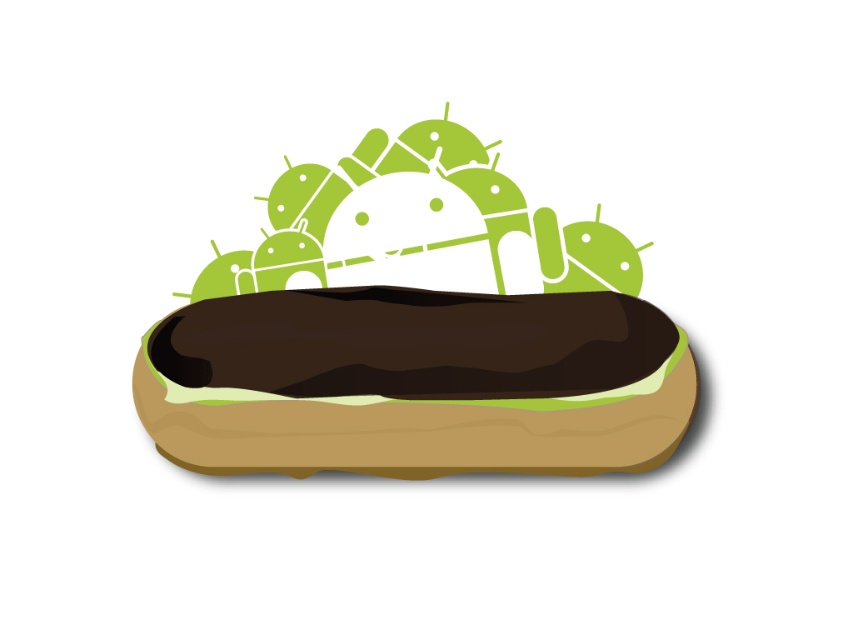
You are looking at the donut with two points marked on it. Which point is closer to you, point (161,422) or point (370,180)?

Point (161,422) is closer to the viewer than point (370,180).

You are a food delivery robot with a height requirement of 10 cm. You need to carry both the brown matte hot dog at center and the green matte androids at upper center in your compartment. The compartment has a height limit of 10 cm. Can both items fit vertically without exceeding the height limit?

The brown matte hot dog at center is shorter than the green matte androids at upper center. Since the compartment has a height limit of 10 cm, we need to check the height of the taller item. If the green matte androids at upper center are taller than 10 cm, then they won